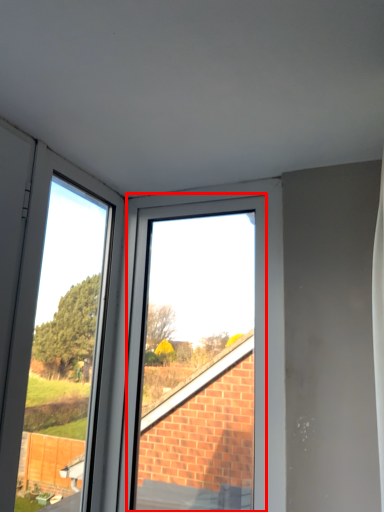
Question: From the image's perspective, where is bay window (annotated by the red box) located relative to glass door?

Choices:
 (A) above
 (B) below

Answer: (B)